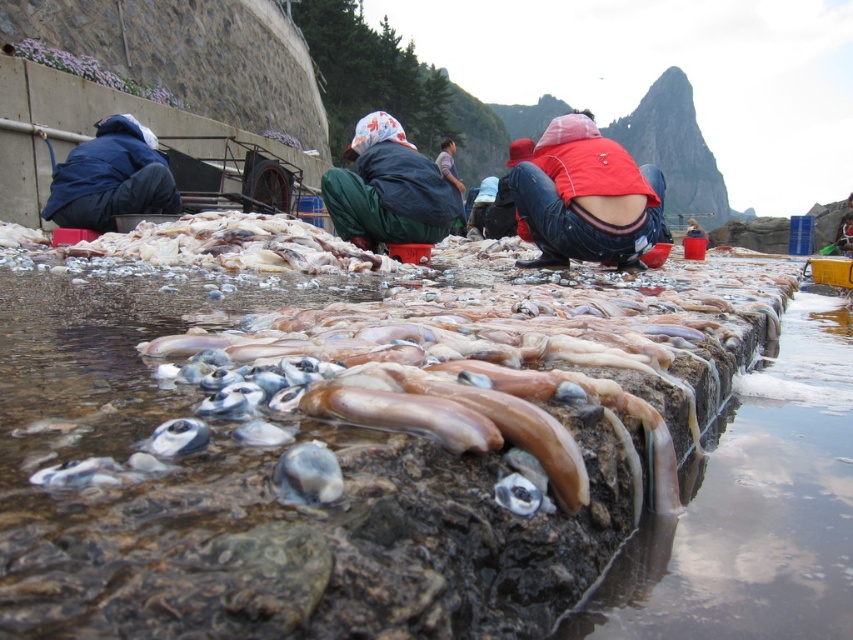
Question: Which object is closer to the camera taking this photo?

Choices:
 (A) dark blue down jacket at left
 (B) translucent wet rock at center
 (C) translucent rubber squid at center

Answer: (B)

Question: From the image, what is the correct spatial relationship of translucent wet rock at center in relation to translucent rubber squid at center?

Choices:
 (A) left
 (B) right

Answer: (A)

Question: Does red matte jacket at center appear on the left side of translucent rubber squid at center?

Choices:
 (A) yes
 (B) no

Answer: (B)

Question: Which object appears farthest from the camera in this image?

Choices:
 (A) green fabric pants at center
 (B) dark blue down jacket at left
 (C) matte black jacket at center

Answer: (C)

Question: Can you confirm if green fabric pants at center is wider than dark blue down jacket at left?

Choices:
 (A) no
 (B) yes

Answer: (B)

Question: Among these objects, which one is farthest from the camera?

Choices:
 (A) translucent rubber squid at center
 (B) dark blue down jacket at left
 (C) green fabric pants at center
 (D) translucent wet rock at center

Answer: (B)